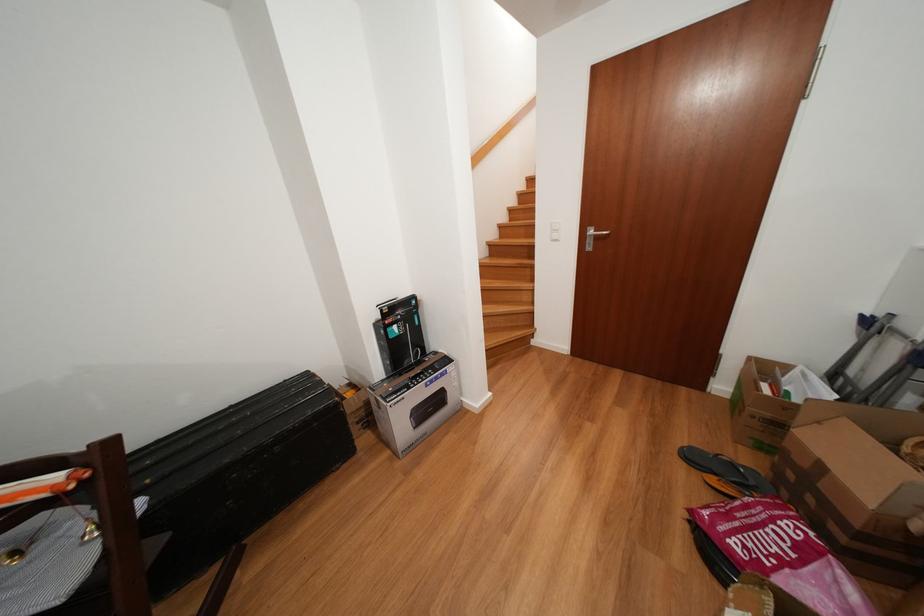
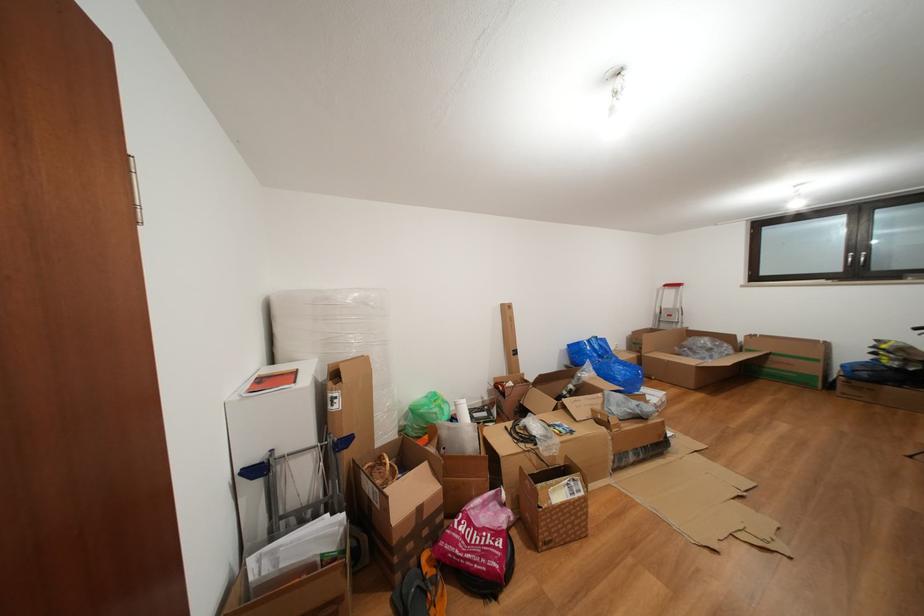
Where in the second image is the point corresponding to [848,578] from the first image?

(480, 511)